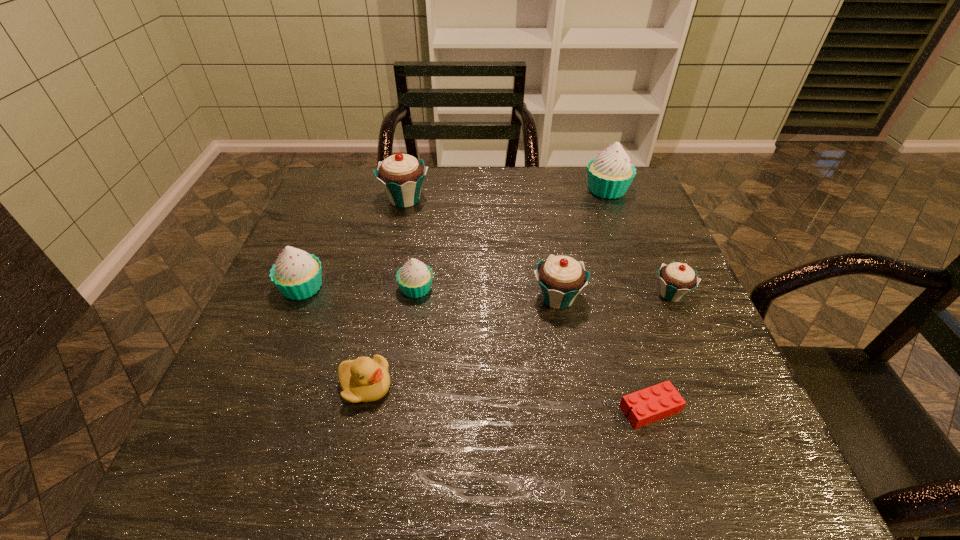
This screenshot has width=960, height=540. What are the coordinates of `the fourth closest object to the smallest teal cupcake` in the screenshot? It's located at (415, 278).

Identify which object is the third nearest to the rightmost teal cupcake. Please provide its 2D coordinates. Your answer should be formatted as a tuple, i.e. [(x, y)], where the tuple contains the x and y coordinates of a point satisfying the conditions above.

[(610, 174)]

Identify which cupcake is located as the fourth nearest to the leftmost object. Please provide its 2D coordinates. Your answer should be formatted as a tuple, i.e. [(x, y)], where the tuple contains the x and y coordinates of a point satisfying the conditions above.

[(610, 174)]

At what (x,y) coordinates should I click in order to perform the action: click on the second closest cupcake relative to the second smallest teal cupcake. Please return your answer as a coordinate pair (x, y). Looking at the image, I should click on (415, 278).

Select which white cupcake appears as the second closest to the second white cupcake from left to right. Please provide its 2D coordinates. Your answer should be formatted as a tuple, i.e. [(x, y)], where the tuple contains the x and y coordinates of a point satisfying the conditions above.

[(610, 174)]

Choose which white cupcake is the second nearest neighbor to the smallest teal cupcake. Please provide its 2D coordinates. Your answer should be formatted as a tuple, i.e. [(x, y)], where the tuple contains the x and y coordinates of a point satisfying the conditions above.

[(415, 278)]

At what (x,y) coordinates should I click in order to perform the action: click on teal cupcake that is the second closest to the farthest teal cupcake. Please return your answer as a coordinate pair (x, y). Looking at the image, I should click on (676, 279).

Where is `teal cupcake that stands as the closest to the smallest teal cupcake`? The height and width of the screenshot is (540, 960). teal cupcake that stands as the closest to the smallest teal cupcake is located at coordinates (x=561, y=278).

I want to click on vacant space that satisfies the following two spatial constraints: 1. on the back side of the biggest white cupcake; 2. on the left side of the farthest teal cupcake, so click(x=407, y=190).

Locate an element on the screen. free space that satisfies the following two spatial constraints: 1. on the front side of the rightmost teal cupcake; 2. on the right side of the smallest white cupcake is located at coordinates (416, 294).